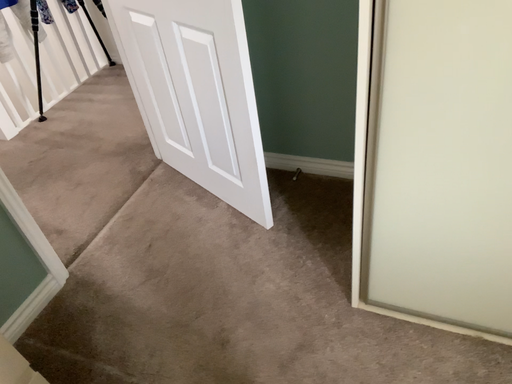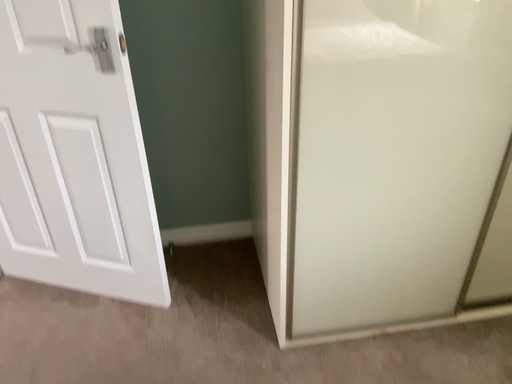
Question: Which way did the camera rotate in the video?

Choices:
 (A) rotated right
 (B) rotated left

Answer: (A)